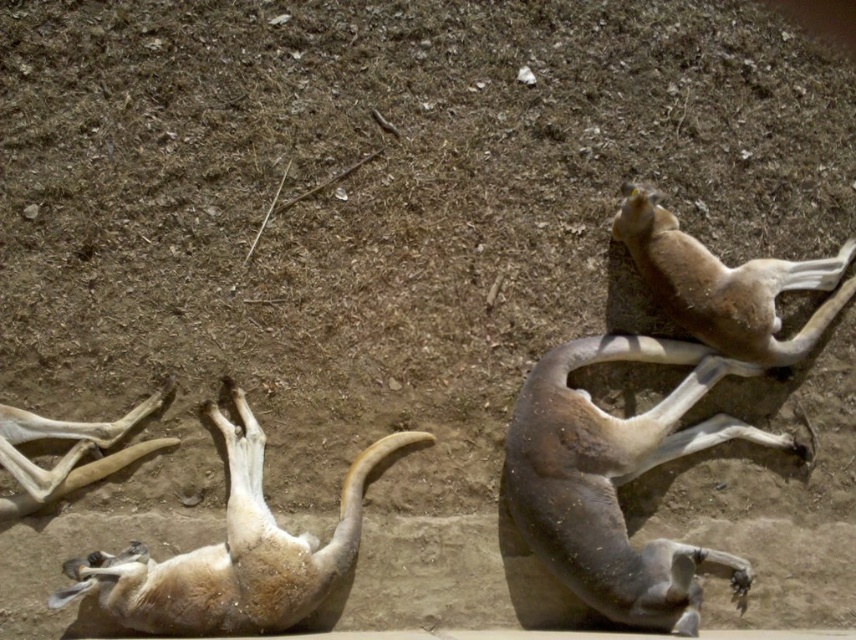
Does brown matte animal at right have a larger size compared to light brown fur at lower left?

Incorrect, brown matte animal at right is not larger than light brown fur at lower left.

Is brown matte animal at right further to camera compared to light brown fur at lower left?

Yes, brown matte animal at right is behind light brown fur at lower left.

Identify the location of brown matte animal at right. Image resolution: width=856 pixels, height=640 pixels. (616, 480).

Looking at this image, is brown matte animal at right positioned in front of brown matte animal at upper right?

Yes.

Is brown matte animal at right further to the viewer compared to brown matte animal at upper right?

No, brown matte animal at right is in front of brown matte animal at upper right.

Describe the element at coordinates (616, 480) in the screenshot. I see `brown matte animal at right` at that location.

You are a GUI agent. You are given a task and a screenshot of the screen. Output one action in this format:
    pyautogui.click(x=<x>, y=<y>)
    Task: Click on the brown matte animal at right
    The image size is (856, 640).
    Given the screenshot: What is the action you would take?
    pyautogui.click(x=616, y=480)

Can you confirm if brown matte animal at right is positioned above light brown bone at lower left?

Incorrect, brown matte animal at right is not positioned above light brown bone at lower left.

Can you confirm if brown matte animal at right is positioned to the right of light brown bone at lower left?

Yes, brown matte animal at right is to the right of light brown bone at lower left.

Is point (603, 426) positioned before point (4, 416)?

No, (603, 426) is further to viewer.

Locate an element on the screen. The image size is (856, 640). brown matte animal at right is located at coordinates (616, 480).